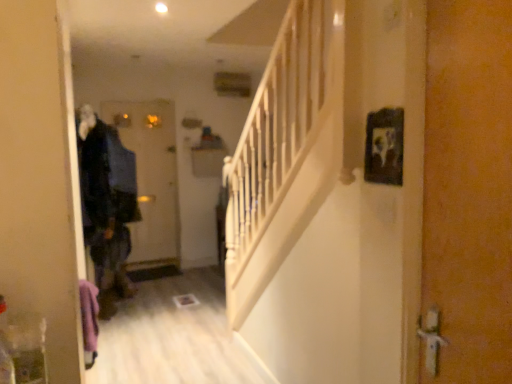
Question: Is dark blue fabric coat at left shorter than matte black door at center, the second door viewed from the front?

Choices:
 (A) yes
 (B) no

Answer: (A)

Question: Is dark blue fabric coat at left surrounding matte black door at center, the second door when ordered from right to left?

Choices:
 (A) yes
 (B) no

Answer: (B)

Question: Considering the relative sizes of dark blue fabric coat at left and matte black door at center, the second door viewed from the front, in the image provided, is dark blue fabric coat at left wider than matte black door at center, the second door viewed from the front,?

Choices:
 (A) no
 (B) yes

Answer: (B)

Question: Does dark blue fabric coat at left appear on the right side of matte black door at center, placed as the 1th door when sorted from back to front?

Choices:
 (A) yes
 (B) no

Answer: (A)

Question: Is the position of dark blue fabric coat at left less distant than that of matte black door at center, which is the first door in left-to-right order?

Choices:
 (A) yes
 (B) no

Answer: (A)

Question: Is dark blue fabric coat at left bigger than matte black door at center, placed as the 1th door when sorted from back to front?

Choices:
 (A) no
 (B) yes

Answer: (B)

Question: Would you say matte black door at center, placed as the 1th door when sorted from back to front, is outside dark blue fabric coat at left?

Choices:
 (A) yes
 (B) no

Answer: (A)

Question: Considering the relative sizes of matte black door at center, which is the first door in left-to-right order, and dark blue fabric coat at left in the image provided, is matte black door at center, which is the first door in left-to-right order, smaller than dark blue fabric coat at left?

Choices:
 (A) yes
 (B) no

Answer: (A)

Question: Is matte black door at center, placed as the 1th door when sorted from back to front, looking in the opposite direction of dark blue fabric coat at left?

Choices:
 (A) no
 (B) yes

Answer: (A)

Question: From the image's perspective, is matte black door at center, placed as the 1th door when sorted from back to front, under dark blue fabric coat at left?

Choices:
 (A) yes
 (B) no

Answer: (A)

Question: Can you confirm if matte black door at center, the second door viewed from the front, is positioned to the right of dark blue fabric coat at left?

Choices:
 (A) yes
 (B) no

Answer: (B)

Question: Is matte black door at center, the second door viewed from the front, bigger than dark blue fabric coat at left?

Choices:
 (A) yes
 (B) no

Answer: (B)

Question: Considering the relative sizes of matte black door at center, placed as the 1th door when sorted from back to front, and orange textured door at right, which is the first door from right to left, in the image provided, is matte black door at center, placed as the 1th door when sorted from back to front, shorter than orange textured door at right, which is the first door from right to left,?

Choices:
 (A) no
 (B) yes

Answer: (A)